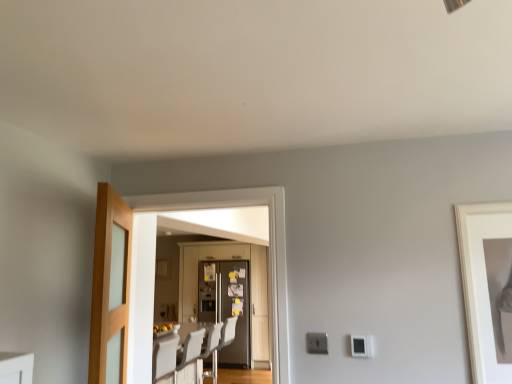
Question: Which direction should I rotate to look at metallic silver refrigerator at center, the 1th door in the back-to-front sequence, — up or down?

Choices:
 (A) down
 (B) up

Answer: (A)

Question: From the image's perspective, is white matte picture frame at right above white plastic swivel chair at center?

Choices:
 (A) yes
 (B) no

Answer: (A)

Question: Is white matte picture frame at right to the right of white plastic swivel chair at center from the viewer's perspective?

Choices:
 (A) no
 (B) yes

Answer: (B)

Question: Is white matte picture frame at right wider than white plastic swivel chair at center?

Choices:
 (A) no
 (B) yes

Answer: (A)

Question: Is white matte picture frame at right far away from white plastic swivel chair at center?

Choices:
 (A) yes
 (B) no

Answer: (A)

Question: Is white matte picture frame at right behind white plastic swivel chair at center?

Choices:
 (A) no
 (B) yes

Answer: (A)

Question: From a real-world perspective, is white matte picture frame at right on white plastic swivel chair at center?

Choices:
 (A) yes
 (B) no

Answer: (A)

Question: Could you tell me if white plastic swivel chair at center is facing matte glass door at center, placed as the 2th door when sorted from front to back?

Choices:
 (A) yes
 (B) no

Answer: (B)

Question: Is white plastic swivel chair at center oriented away from matte glass door at center, placed as the 2th door when sorted from front to back?

Choices:
 (A) no
 (B) yes

Answer: (A)

Question: Does white plastic swivel chair at center have a greater width compared to matte glass door at center, placed as the 2th door when sorted from front to back?

Choices:
 (A) no
 (B) yes

Answer: (B)

Question: Does white plastic swivel chair at center appear on the right side of matte glass door at center, placed as the 2th door when sorted from front to back?

Choices:
 (A) yes
 (B) no

Answer: (B)

Question: Can you confirm if white plastic swivel chair at center is shorter than matte glass door at center, placed as the 2th door when sorted from front to back?

Choices:
 (A) no
 (B) yes

Answer: (A)

Question: Is white plastic swivel chair at center smaller than matte glass door at center, placed as the 2th door when sorted from front to back?

Choices:
 (A) no
 (B) yes

Answer: (A)

Question: Does metallic silver refrigerator at center, the 1th door in the back-to-front sequence, appear on the left side of metallic gray refrigerator at center?

Choices:
 (A) no
 (B) yes

Answer: (B)